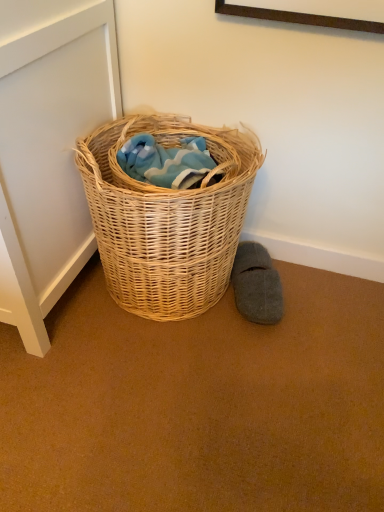
Question: From a real-world perspective, is woven natural basket at center on gray felt slipper at lower right?

Choices:
 (A) no
 (B) yes

Answer: (B)

Question: Is woven natural basket at center facing towards gray felt slipper at lower right?

Choices:
 (A) yes
 (B) no

Answer: (B)

Question: Can gray felt slipper at lower right be found inside woven natural basket at center?

Choices:
 (A) no
 (B) yes

Answer: (A)

Question: From the image's perspective, is woven natural basket at center above gray felt slipper at lower right?

Choices:
 (A) yes
 (B) no

Answer: (A)

Question: Is woven natural basket at center beside gray felt slipper at lower right?

Choices:
 (A) yes
 (B) no

Answer: (B)

Question: Can you confirm if woven natural basket at center is smaller than gray felt slipper at lower right?

Choices:
 (A) no
 (B) yes

Answer: (A)

Question: Is gray felt slipper at lower right not close to woven natural basket at center?

Choices:
 (A) no
 (B) yes

Answer: (A)

Question: Considering the relative sizes of gray felt slipper at lower right and woven natural basket at center in the image provided, is gray felt slipper at lower right taller than woven natural basket at center?

Choices:
 (A) yes
 (B) no

Answer: (B)

Question: Is gray felt slipper at lower right positioned behind woven natural basket at center?

Choices:
 (A) yes
 (B) no

Answer: (A)

Question: Could you tell me if gray felt slipper at lower right is facing woven natural basket at center?

Choices:
 (A) yes
 (B) no

Answer: (B)

Question: Is gray felt slipper at lower right bigger than woven natural basket at center?

Choices:
 (A) yes
 (B) no

Answer: (B)

Question: Is the position of gray felt slipper at lower right less distant than that of woven natural basket at center?

Choices:
 (A) no
 (B) yes

Answer: (A)

Question: Is woven natural basket at center spatially inside gray felt slipper at lower right, or outside of it?

Choices:
 (A) outside
 (B) inside

Answer: (A)